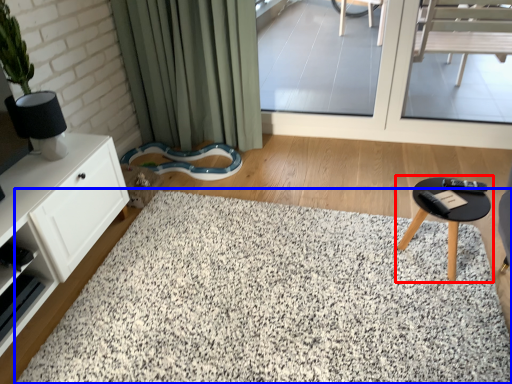
Question: Among these objects, which one is nearest to the camera, table (highlighted by a red box) or mat (highlighted by a blue box)?

Choices:
 (A) table
 (B) mat

Answer: (B)